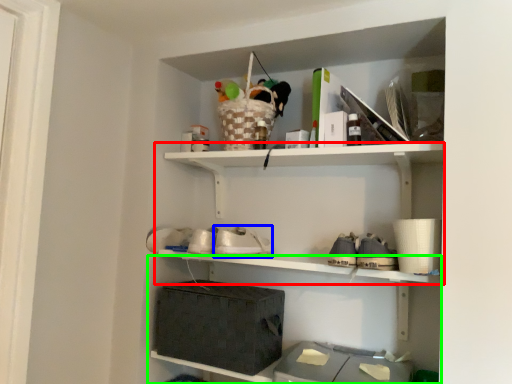
Question: Estimate the real-world distances between objects in this image. Which object is closer to shelf (highlighted by a red box), shoe (highlighted by a blue box) or shelf (highlighted by a green box)?

Choices:
 (A) shoe
 (B) shelf

Answer: (B)